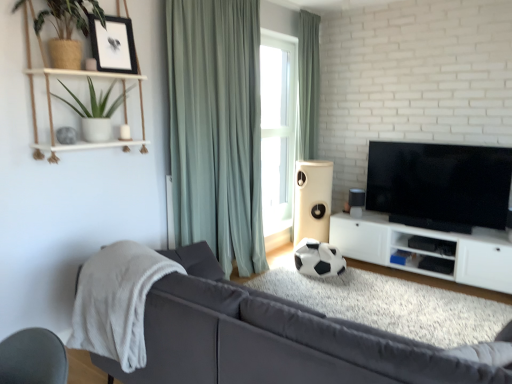
What do you see at coordinates (440, 185) in the screenshot? I see `flat screen tv at right` at bounding box center [440, 185].

Locate an element on the screen. The width and height of the screenshot is (512, 384). white fluffy blanket at left is located at coordinates (117, 301).

Is there a large distance between light green fabric curtain at upper center, the second curtain from the front, and flat screen tv at right?

light green fabric curtain at upper center, the second curtain from the front, is positioned a significant distance from flat screen tv at right.

Can you confirm if light green fabric curtain at upper center, the second curtain from the front, is taller than flat screen tv at right?

Indeed, light green fabric curtain at upper center, the second curtain from the front, has a greater height compared to flat screen tv at right.

Is light green fabric curtain at upper center, the second curtain from the front, to the right of flat screen tv at right from the viewer's perspective?

Incorrect, light green fabric curtain at upper center, the second curtain from the front, is not on the right side of flat screen tv at right.

Considering the relative sizes of light green fabric curtain at upper center, arranged as the 1th curtain when viewed from the right, and flat screen tv at right in the image provided, is light green fabric curtain at upper center, arranged as the 1th curtain when viewed from the right, smaller than flat screen tv at right?

Yes.

Can you see green matte plant at upper left touching satin black speaker at lower right, which is the 1th speaker from right to left?

No, green matte plant at upper left is not touching satin black speaker at lower right, which is the 1th speaker from right to left.

Which is more to the right, green matte plant at upper left or satin black speaker at lower right, which is the 1th speaker from right to left?

Positioned to the right is satin black speaker at lower right, which is the 1th speaker from right to left.

Is green matte plant at upper left outside of satin black speaker at lower right, which is the 1th speaker from right to left?

That's correct, green matte plant at upper left is outside of satin black speaker at lower right, which is the 1th speaker from right to left.

From the image's perspective, is green matte plant at upper left on satin black speaker at lower right, which is the 1th speaker from right to left?

Correct, green matte plant at upper left appears higher than satin black speaker at lower right, which is the 1th speaker from right to left, in the image.

Between point (350, 197) and point (301, 213), which one is positioned behind?

The point (301, 213) is behind.

Is satin black speaker at lower right, which is the 2th speaker in left-to-right order, outside of matte white speaker at center, which ranks as the 1th speaker in left-to-right order?

Absolutely, satin black speaker at lower right, which is the 2th speaker in left-to-right order, is external to matte white speaker at center, which ranks as the 1th speaker in left-to-right order.

Relative to matte white speaker at center, positioned as the 2th speaker in right-to-left order, is satin black speaker at lower right, which is the 1th speaker from right to left, in front or behind?

satin black speaker at lower right, which is the 1th speaker from right to left, is in front of matte white speaker at center, positioned as the 2th speaker in right-to-left order.

Considering the relative sizes of satin black speaker at lower right, which is the 2th speaker in left-to-right order, and matte white speaker at center, positioned as the 2th speaker in right-to-left order, in the image provided, is satin black speaker at lower right, which is the 2th speaker in left-to-right order, smaller than matte white speaker at center, positioned as the 2th speaker in right-to-left order,?

Yes.

How distant is matte gray couch at center from matte white speaker at center, which ranks as the 1th speaker in left-to-right order?

matte gray couch at center is 2.76 meters from matte white speaker at center, which ranks as the 1th speaker in left-to-right order.

From the image's perspective, is matte gray couch at center located beneath matte white speaker at center, positioned as the 2th speaker in right-to-left order?

Yes, from the image's perspective, matte gray couch at center is below matte white speaker at center, positioned as the 2th speaker in right-to-left order.

In the scene shown: Can you confirm if matte gray couch at center is wider than matte white speaker at center, positioned as the 2th speaker in right-to-left order?

Yes, matte gray couch at center is wider than matte white speaker at center, positioned as the 2th speaker in right-to-left order.

Can you tell me how much matte gray couch at center and matte white speaker at center, which ranks as the 1th speaker in left-to-right order, differ in facing direction?

A: They differ by 180 degrees in their facing directions.

What's the angular difference between green matte plant at upper left and black matte picture frame at upper left's facing directions?

The angle between the facing direction of green matte plant at upper left and the facing direction of black matte picture frame at upper left is 15 degrees.

From a real-world perspective, is green matte plant at upper left on top of black matte picture frame at upper left?

No, from a real-world perspective, green matte plant at upper left is not over black matte picture frame at upper left

How much distance is there between green matte plant at upper left and black matte picture frame at upper left?

green matte plant at upper left and black matte picture frame at upper left are 25.50 centimeters apart.

Could you tell me if green matte plant at upper left is turned towards black matte picture frame at upper left?

No, green matte plant at upper left does not turn towards black matte picture frame at upper left.

Is white wood shelf at upper left positioned before matte gray couch at center?

No, white wood shelf at upper left is further to the viewer.

Does white wood shelf at upper left touch matte gray couch at center?

No, white wood shelf at upper left is not with matte gray couch at center.

Which object is positioned more to the left, white wood shelf at upper left or matte gray couch at center?

white wood shelf at upper left is more to the left.

In the scene shown: Could you tell me if white wood shelf at upper left is turned towards matte gray couch at center?

No, white wood shelf at upper left is not facing towards matte gray couch at center.

Between black matte picture frame at upper left and green matte plant at upper left, which one is positioned behind?

black matte picture frame at upper left is further from the camera.

From a real-world perspective, which object stands above the other?

black matte picture frame at upper left.

Which object is positioned more to the right, black matte picture frame at upper left or green matte plant at upper left?

From the viewer's perspective, black matte picture frame at upper left appears more on the right side.

Locate an element on the screen. The width and height of the screenshot is (512, 384). television lying on the right of light green fabric curtain at upper center, which is counted as the 1th curtain, starting from the back is located at coordinates (440, 185).

Locate an element on the screen. shelf to the left of satin black speaker at lower right, which is the 1th speaker from right to left is located at coordinates (84, 143).

Estimate the real-world distances between objects in this image. Which object is further from white fluffy blanket at left, matte gray couch at center or black matte picture frame at upper left?

black matte picture frame at upper left is further to white fluffy blanket at left.

Looking at the image, which one is located closer to white matte cabinet at lower right, black matte picture frame at upper left or light green fabric curtain at upper center, which is counted as the 1th curtain, starting from the back?

Among the two, light green fabric curtain at upper center, which is counted as the 1th curtain, starting from the back, is located nearer to white matte cabinet at lower right.

Based on their spatial positions, is green matte plant at upper left or green fabric curtain at center, the first curtain when ordered from front to back, closer to white wood shelf at upper left?

green matte plant at upper left is positioned closer to the anchor white wood shelf at upper left.

From the image, which object appears to be nearer to matte gray couch at center, white wood shelf at upper left or white matte cabinet at lower right?

white wood shelf at upper left lies closer to matte gray couch at center than the other object.

Considering their positions, is white fluffy blanket at left positioned further to green matte plant at upper left than white wood shelf at upper left?

white fluffy blanket at left.

From the picture: Looking at the image, which one is located further to matte white speaker at center, positioned as the 2th speaker in right-to-left order, matte gray couch at center or white fluffy blanket at left?

The object further to matte white speaker at center, positioned as the 2th speaker in right-to-left order, is matte gray couch at center.

Looking at this image, estimate the real-world distances between objects in this image. Which object is further from white wood shelf at upper left, green fabric curtain at center, the first curtain when ordered from front to back, or black matte picture frame at upper left?

Based on the image, green fabric curtain at center, the first curtain when ordered from front to back, appears to be further to white wood shelf at upper left.

Based on their spatial positions, is light green fabric curtain at upper center, which is counted as the 1th curtain, starting from the back, or matte white speaker at center, which ranks as the 1th speaker in left-to-right order, closer to white matte cabinet at lower right?

matte white speaker at center, which ranks as the 1th speaker in left-to-right order, lies closer to white matte cabinet at lower right than the other object.

You are a GUI agent. You are given a task and a screenshot of the screen. Output one action in this format:
    pyautogui.click(x=<x>, y=<y>)
    Task: Click on the cabinetry between white wood shelf at upper left and flat screen tv at right
    Image resolution: width=512 pixels, height=384 pixels.
    Given the screenshot: What is the action you would take?
    pyautogui.click(x=426, y=251)

Locate an element on the screen. picture frame between white fluffy blanket at left and matte white speaker at center, positioned as the 2th speaker in right-to-left order, along the z-axis is located at coordinates (113, 45).

Where is `picture frame located between white wood shelf at upper left and matte white speaker at center, positioned as the 2th speaker in right-to-left order, in the depth direction`? Image resolution: width=512 pixels, height=384 pixels. picture frame located between white wood shelf at upper left and matte white speaker at center, positioned as the 2th speaker in right-to-left order, in the depth direction is located at coordinates (113, 45).

In order to click on curtain located between matte gray couch at center and light green fabric curtain at upper center, placed as the 2th curtain when sorted from left to right, in the depth direction in this screenshot , I will do `click(216, 128)`.